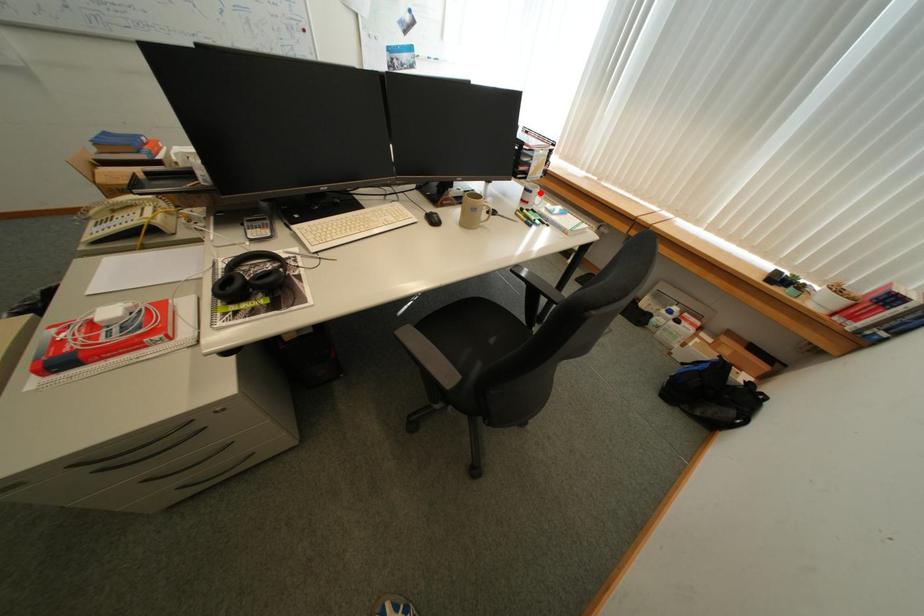
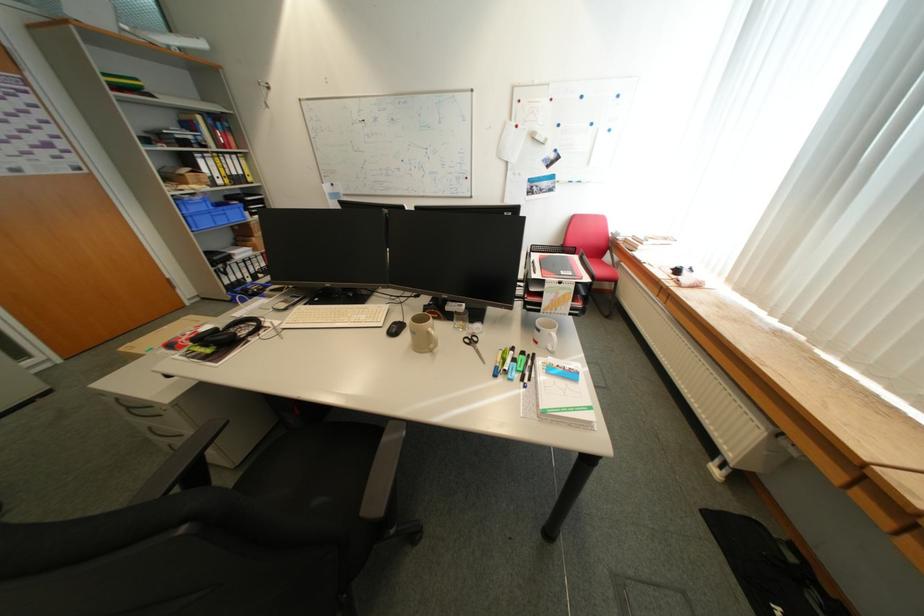
Where in the second image is the point corresponding to the highlighted location from the first image?

(548, 331)